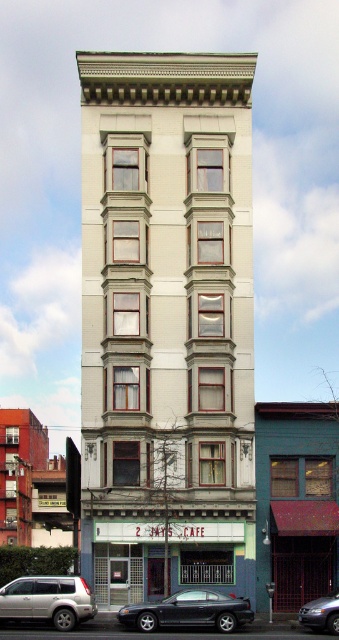
You are standing at the entrance of 2 JAYS CAFE and want to know how far the point at coordinates point (233,628) is from you. Can you determine the distance?

The distance between you and point (233,628) is 200.34 feet.

You are standing in front of the building and want to find the shiny black sedan at lower center. Where should you look relative to the point marked at coordinates (189, 611)?

The shiny black sedan at lower center is located exactly at the point marked at coordinates (189, 611).

You are standing in front of the multi story building and want to take a photo. You notice two points marked on the building facade. The first point is at coordinate point (41, 616) and the second is at point (337, 609). Which point will appear larger in your photo?

Point (41, 616) will appear larger in the photo because it is closer to the camera than point (337, 609).